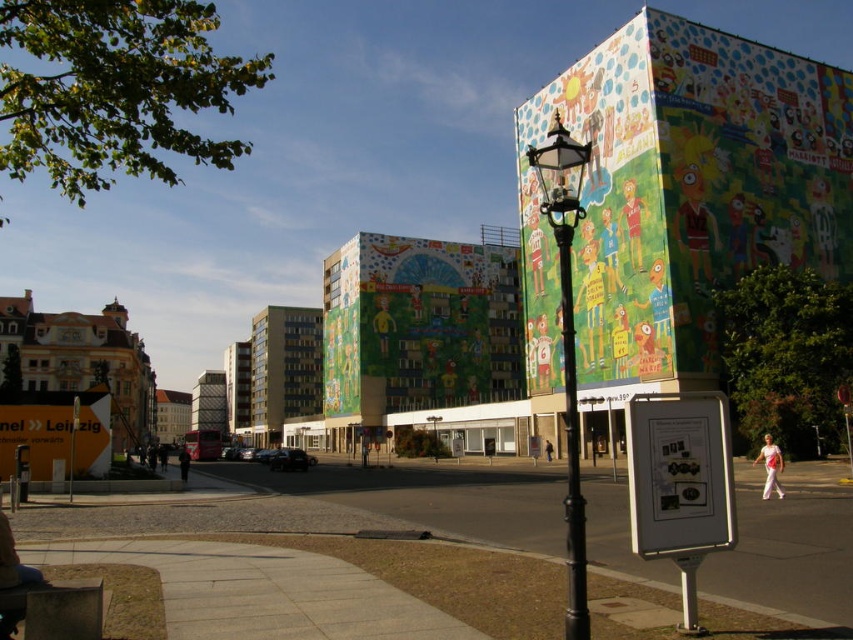
Question: Does smooth concrete pavement at lower left have a larger size compared to polished brass lamp post at center-right?

Choices:
 (A) yes
 (B) no

Answer: (B)

Question: Which point is closer to the camera?

Choices:
 (A) (825, 561)
 (B) (573, 372)

Answer: (A)

Question: Does smooth concrete pavement at lower left have a greater width compared to polished brass lamp post at center-right?

Choices:
 (A) no
 (B) yes

Answer: (B)

Question: Can you confirm if smooth concrete pavement at lower left is positioned to the left of polished brass lamp post at center-right?

Choices:
 (A) no
 (B) yes

Answer: (B)

Question: Among these points, which one is nearest to the camera?

Choices:
 (A) (573, 461)
 (B) (756, 557)

Answer: (A)